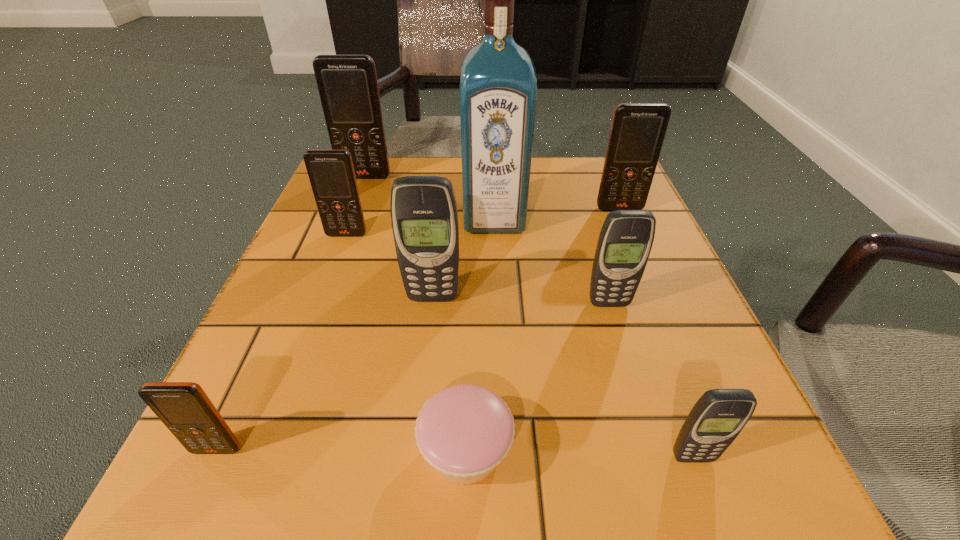
At what (x,y) coordinates should I click in order to perform the action: click on the second smallest orange cellular telephone. Please return your answer as a coordinate pair (x, y). Image resolution: width=960 pixels, height=540 pixels. Looking at the image, I should click on (331, 173).

Identify the location of the smallest orange cellular telephone. This screenshot has width=960, height=540. [x=184, y=408].

In order to click on the smallest gray cellular telephone in this screenshot , I will do `click(717, 418)`.

Where is `cupcake`? cupcake is located at coordinates (464, 431).

Where is `pink cupcake`? The width and height of the screenshot is (960, 540). pink cupcake is located at coordinates (464, 431).

The height and width of the screenshot is (540, 960). Identify the location of vacant area located on the flat label side of the tallest object. (502, 421).

Where is `free region located on the screen of the farthest cellular telephone`? free region located on the screen of the farthest cellular telephone is located at coordinates (336, 253).

Where is `free space located on the screen of the second farthest cellular telephone`? This screenshot has width=960, height=540. free space located on the screen of the second farthest cellular telephone is located at coordinates (630, 232).

The image size is (960, 540). I want to click on vacant region located on the screen of the biggest gray cellular telephone, so click(x=410, y=496).

At what (x,y) coordinates should I click in order to perform the action: click on vacant space located 0.150m on the screen of the second smallest gray cellular telephone. Please return your answer as a coordinate pair (x, y). Looking at the image, I should click on (634, 385).